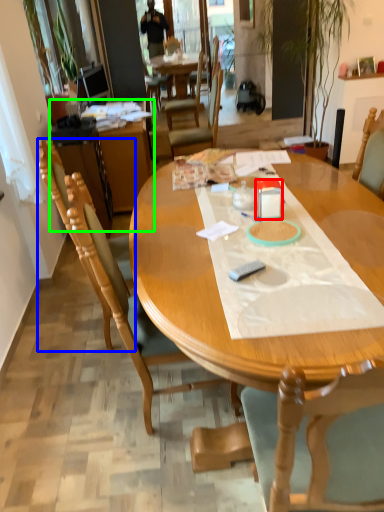
Question: Which object is the closest to the box (highlighted by a red box)? Choose among these: chair (highlighted by a blue box) or computer desk (highlighted by a green box).

Choices:
 (A) chair
 (B) computer desk

Answer: (A)